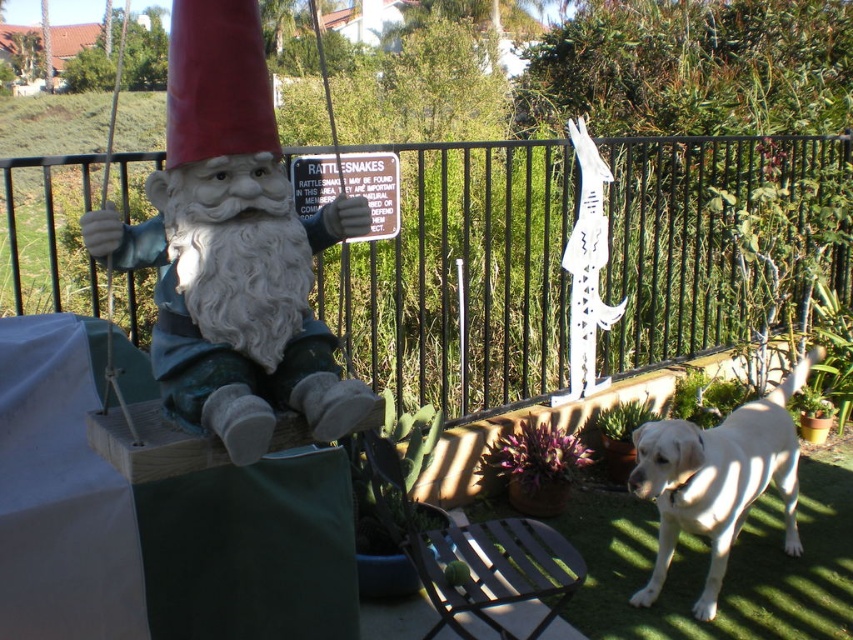
Question: Estimate the real-world distances between objects in this image. Which object is closer to the metallic silver sign at upper center?

Choices:
 (A) metallic silver chair at center
 (B) white fur dog at lower right
 (C) black metal fence at upper center

Answer: (A)

Question: Which point is closer to the camera?

Choices:
 (A) black metal fence at upper center
 (B) metallic silver sign at upper center

Answer: (A)

Question: Which point appears farthest from the camera in this image?

Choices:
 (A) (373, 156)
 (B) (480, 218)

Answer: (B)

Question: Is the position of metallic silver chair at center more distant than that of metallic silver sign at upper center?

Choices:
 (A) no
 (B) yes

Answer: (A)

Question: Is metallic silver chair at center positioned in front of metallic silver sign at upper center?

Choices:
 (A) no
 (B) yes

Answer: (B)

Question: Does matte ceramic gnome at left have a smaller size compared to metallic silver sign at upper center?

Choices:
 (A) yes
 (B) no

Answer: (B)